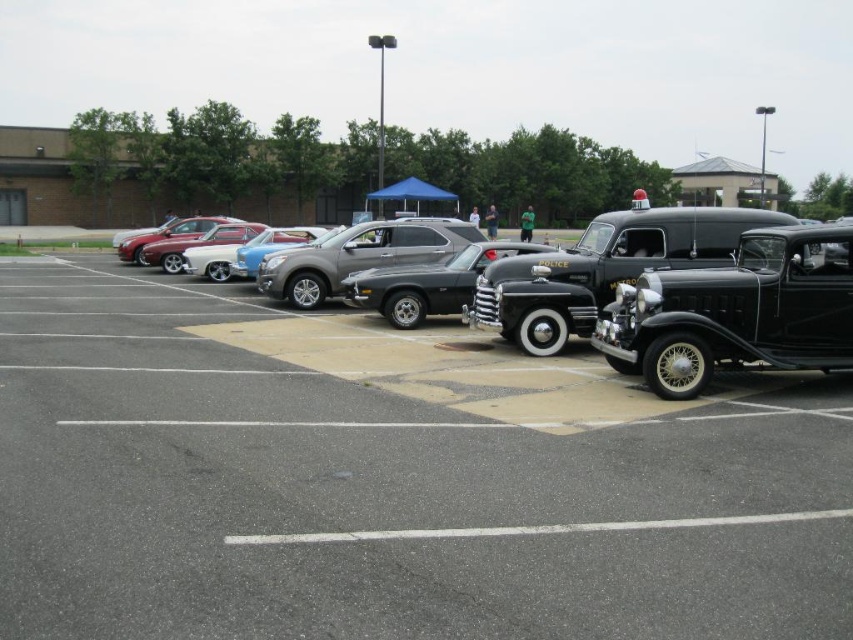
You are a parking attendant who needs to fit a new car into the parking lot. The new car is 2 meters wide. You see the satin silver suv at center and the shiny silver sedan at center. Which vehicle has enough space between them to accommodate the new car?

The shiny silver sedan at center is wider than the satin silver suv at center. Since the satin silver suv at center is thinner, the space between them might be sufficient for the new car, but the exact width isn

You are a photographer positioned at the back of the parking lot. You want to take a photo of the shiny silver sedan at center without the satin silver suv at center blocking it. Is it possible to do so given their positions?

The satin silver suv at center is in front of the shiny silver sedan at center, so you cannot take a photo of the shiny silver sedan at center without the satin silver suv at center blocking it unless you move the suv or change your position.

You are a delivery person needing to park your van between the shiny black police car at center and the shiny silver sedan at center. Your van is 20 feet long. Can you fit your van between them without overlapping the cars?

The distance between the shiny black police car at center and the shiny silver sedan at center is 54.07 feet. Since your van is only 20 feet long, there is enough space to park it between them without overlapping the cars.